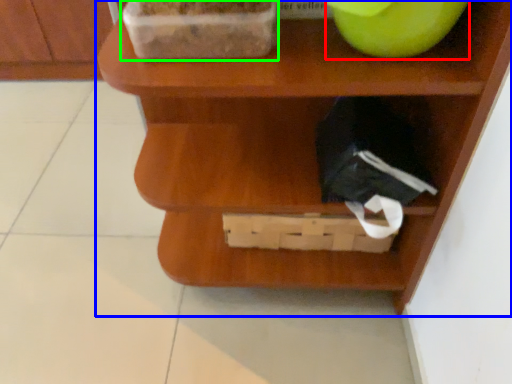
Question: Estimate the real-world distances between objects in this image. Which object is closer to apple (highlighted by a red box), shelf (highlighted by a blue box) or wide (highlighted by a green box)?

Choices:
 (A) shelf
 (B) wide

Answer: (B)